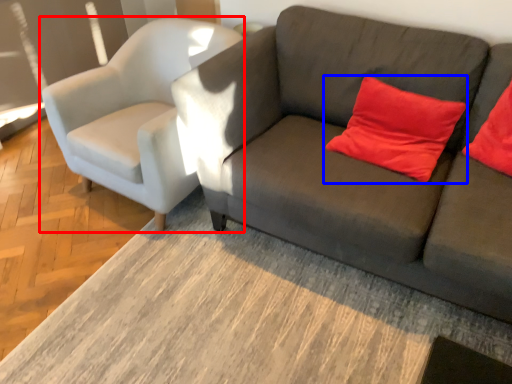
Question: Which of the following is the closest to the observer, chair (highlighted by a red box) or pillow (highlighted by a blue box)?

Choices:
 (A) chair
 (B) pillow

Answer: (B)